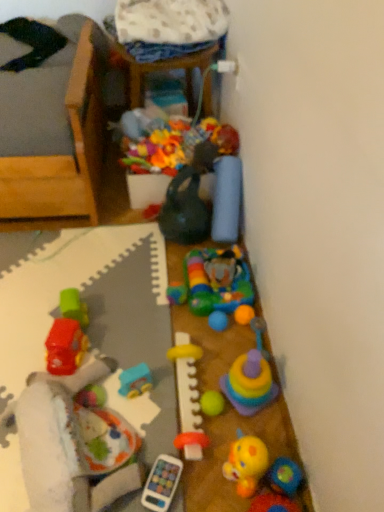
Locate an element on the screen. The width and height of the screenshot is (384, 512). vacant area that lies between rubberized plastic stacking cups at center-right, which is counted as the 3th toy, starting from the right, and rubber duck at center, which is the 7th toy in left-to-right order is located at coordinates (257, 432).